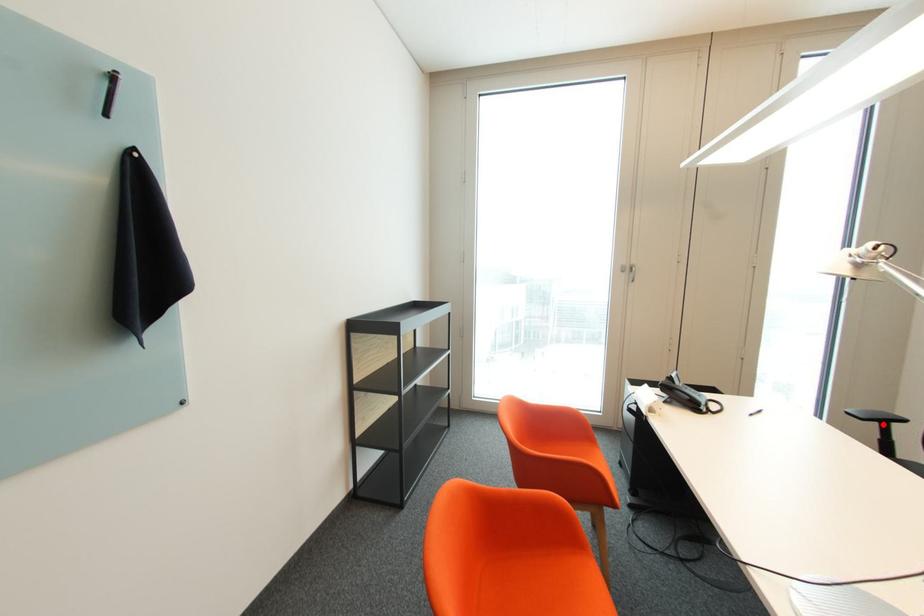
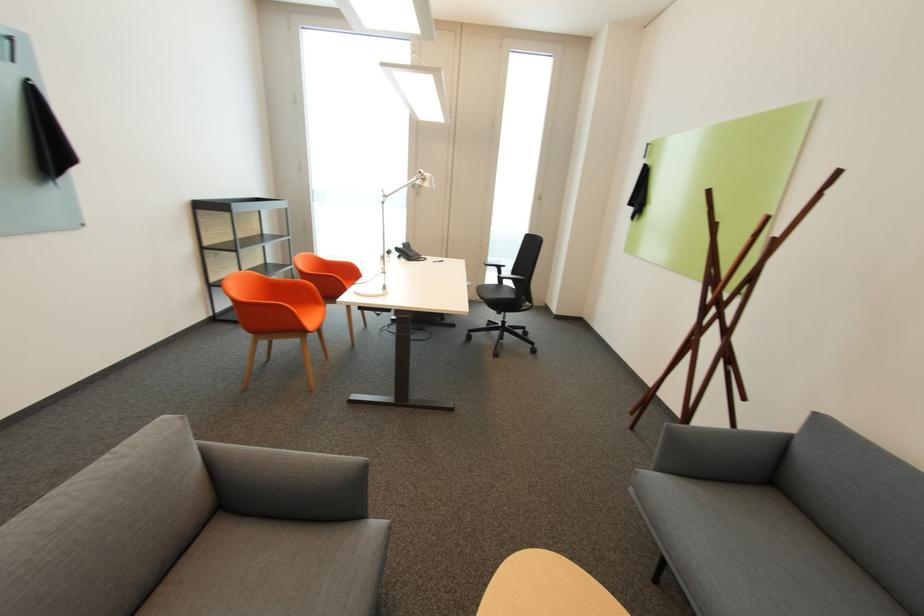
In the second image, find the point that corresponds to the highlighted location in the first image.

(503, 269)